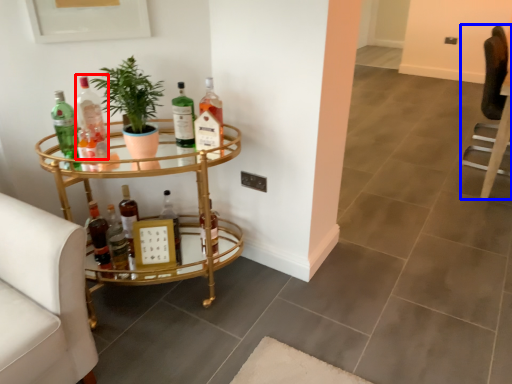
Question: Which point is closer to the camera, bottle (highlighted by a red box) or swivel chair (highlighted by a blue box)?

Choices:
 (A) bottle
 (B) swivel chair

Answer: (A)